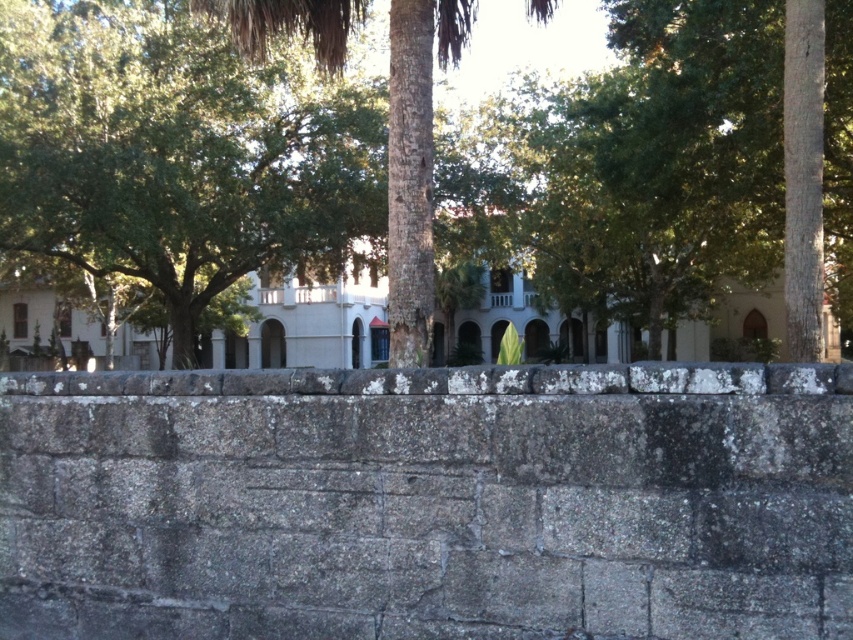
You are standing in the serene outdoor scene with the stone wall in front of you. You notice a point marked at coordinates (175,150). What object does this point correspond to?

The point at coordinates (175,150) corresponds to the green leafy tree at center.

You are a bird looking for a nesting spot. You see the green leafy tree at center and the bark textured palm tree at center. Which tree is taller and would provide a better vantage point?

The green leafy tree at center is much taller than the bark textured palm tree at center, so it would provide a better vantage point.

You are planning to plant a garden between the green leafy tree at center and the bark textured palm tree at center. Considering their sizes, which tree will require more space for its canopy?

The green leafy tree at center requires more space for its canopy since it is larger in size than the bark textured palm tree at center.